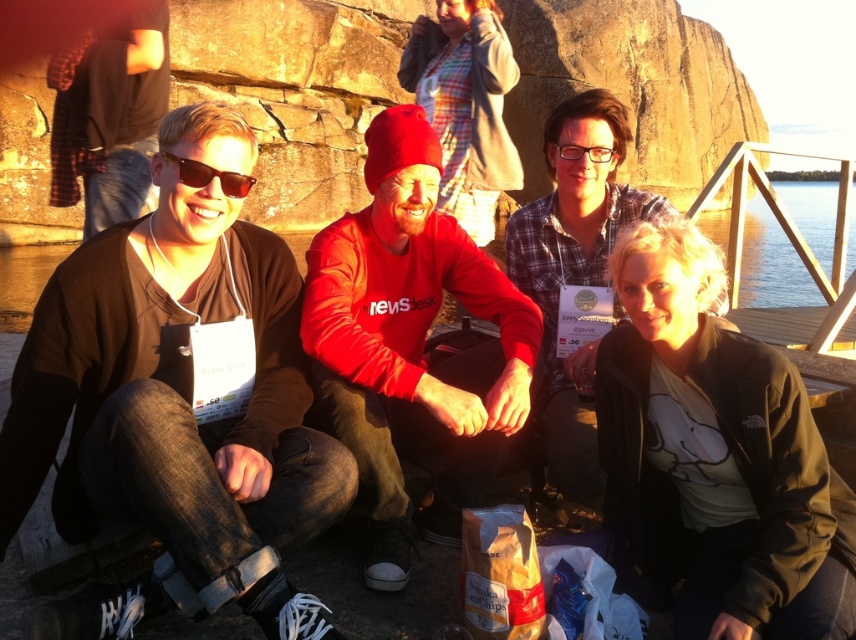
Question: Does matte black sunglasses at left come behind clear plastic glasses at center?

Choices:
 (A) yes
 (B) no

Answer: (B)

Question: Which point is farther to the camera?

Choices:
 (A) (201, 164)
 (B) (601, 163)

Answer: (B)

Question: Among these objects, which one is nearest to the camera?

Choices:
 (A) clear plastic glasses at center
 (B) matte black sunglasses at left

Answer: (B)

Question: Among these objects, which one is nearest to the camera?

Choices:
 (A) clear plastic glasses at center
 (B) matte black sunglasses at left

Answer: (B)

Question: Is matte black sunglasses at left wider than clear plastic glasses at center?

Choices:
 (A) no
 (B) yes

Answer: (B)

Question: Is the position of matte black sunglasses at left more distant than that of clear plastic glasses at center?

Choices:
 (A) yes
 (B) no

Answer: (B)